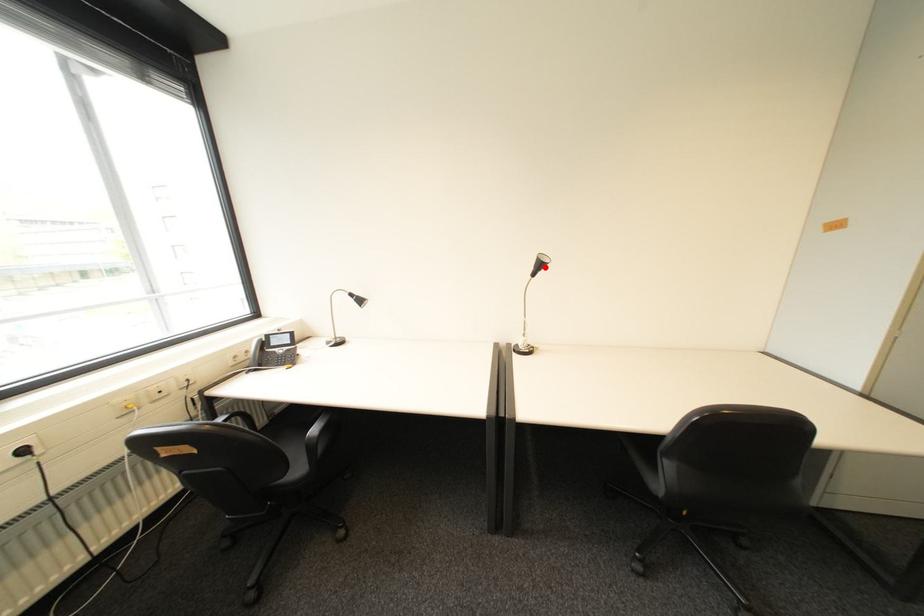
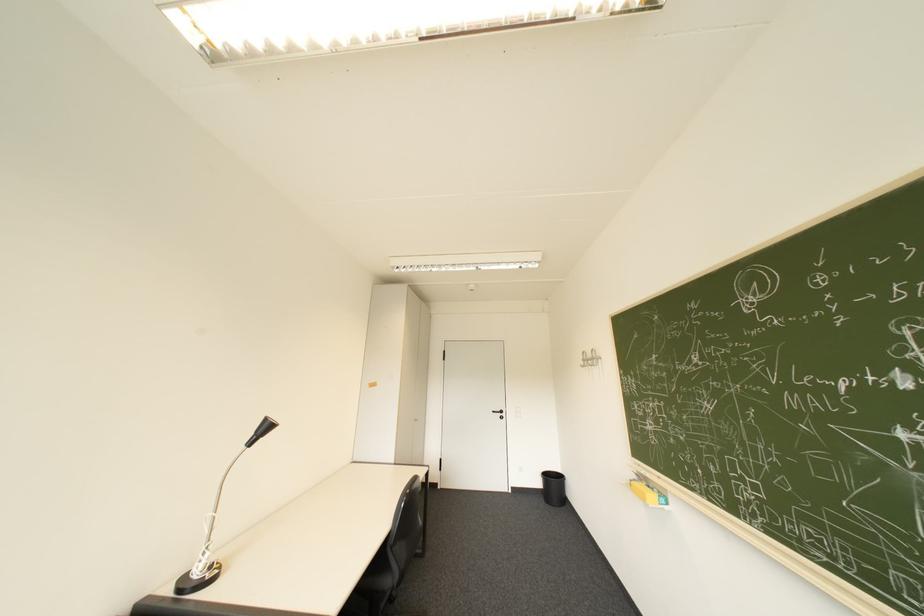
In the second image, find the point that corresponds to the highlighted location in the first image.

(266, 434)